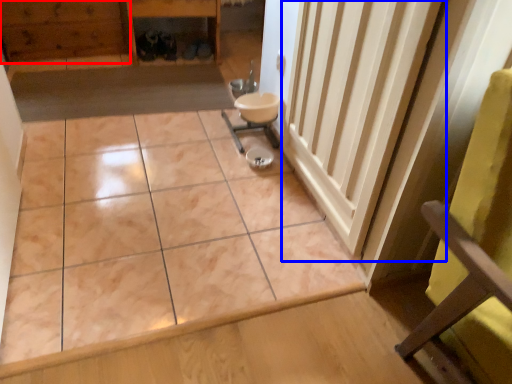
Question: Which object appears farthest to the camera in this image, hardwood (highlighted by a red box) or radiator (highlighted by a blue box)?

Choices:
 (A) hardwood
 (B) radiator

Answer: (A)